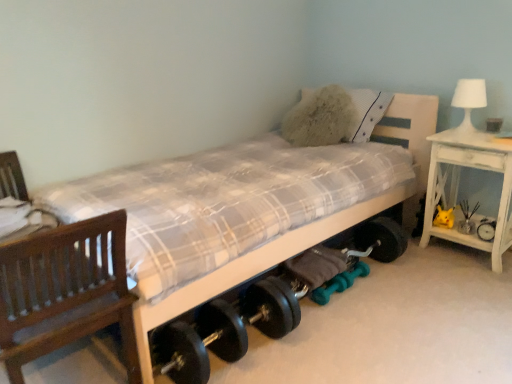
Where is `vacant area to the right of teal rubber dumbbell at lower center, the first dumbbell from the right`? This screenshot has height=384, width=512. vacant area to the right of teal rubber dumbbell at lower center, the first dumbbell from the right is located at coordinates (386, 283).